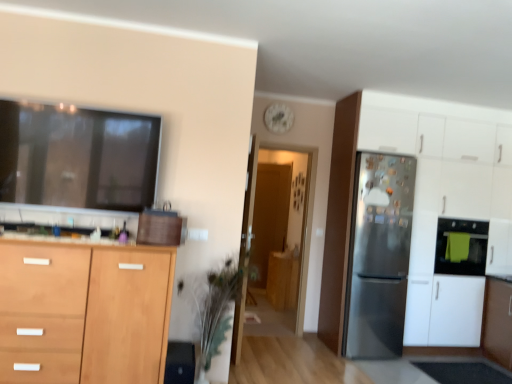
Question: In terms of width, does green towel oven at right look wider or thinner when compared to satin silver refrigerator at right, which is the 3th cabinetry in left-to-right order?

Choices:
 (A) thin
 (B) wide

Answer: (A)

Question: Considering the relative positions of green towel oven at right and satin silver refrigerator at right, the 2th cabinetry when ordered from front to back, in the image provided, is green towel oven at right to the left or to the right of satin silver refrigerator at right, the 2th cabinetry when ordered from front to back,?

Choices:
 (A) right
 (B) left

Answer: (A)

Question: Which is nearer to the satin silver refrigerator at right, the first cabinetry positioned from the right?

Choices:
 (A) transparent glass door at center, which is counted as the 1th glass door, starting from the back
 (B) wooden cabinet at lower left
 (C) green towel oven at right
 (D) satin silver refrigerator at right
 (E) wooden cabinet at center, which is counted as the 1th cabinetry, starting from the back

Answer: (D)

Question: Which object is the farthest from the satin silver refrigerator at right?

Choices:
 (A) green leafy plant at center
 (B) wooden cabinet at center, which is counted as the 1th cabinetry, starting from the back
 (C) green towel oven at right
 (D) transparent glass door at center, acting as the first glass door starting from the front
 (E) wooden cabinet at lower left

Answer: (E)